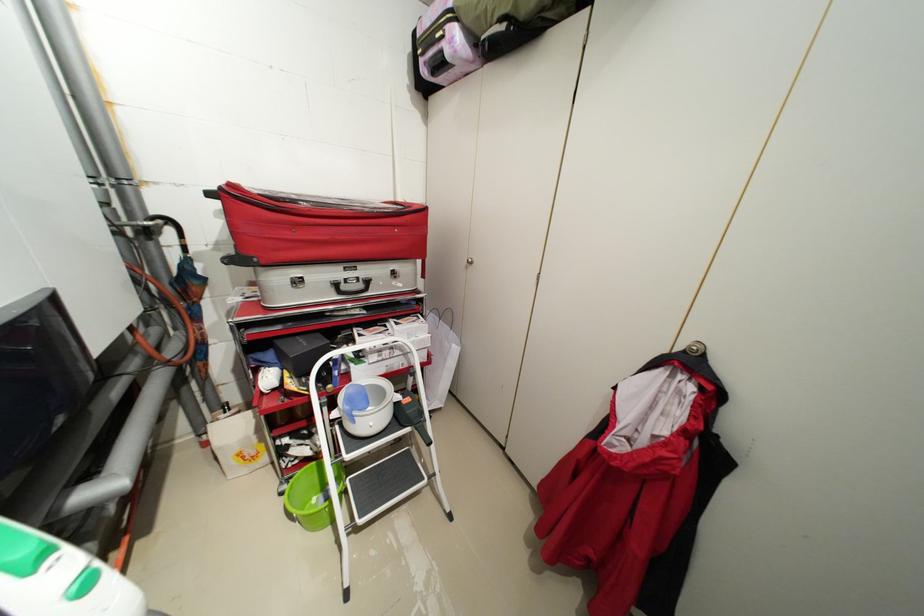
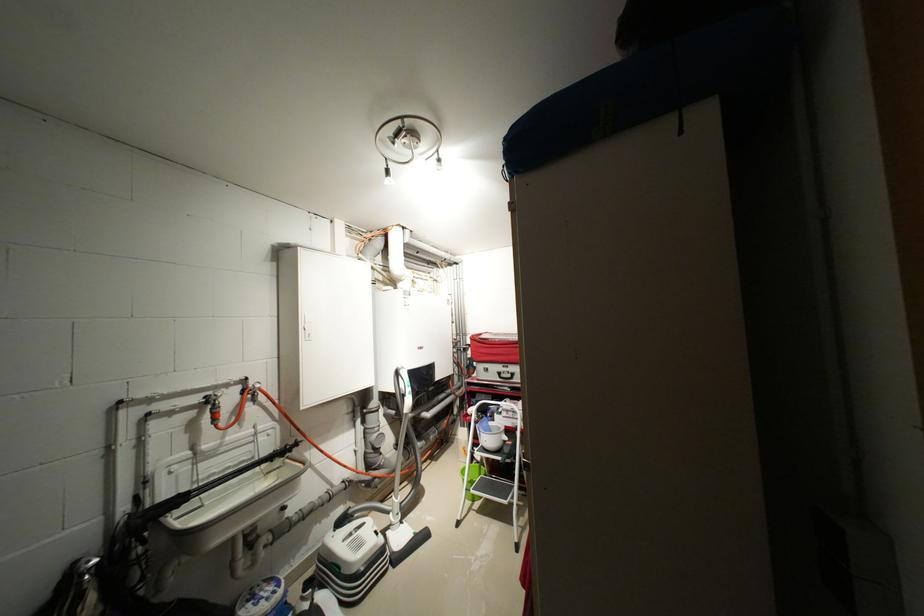
The point at (329, 407) is marked in the first image. Where is the corresponding point in the second image?

(482, 424)